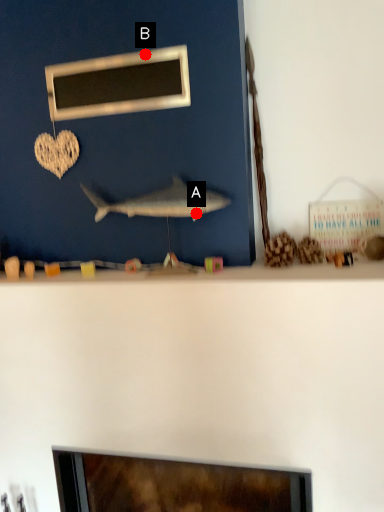
Question: Two points are circled on the image, labeled by A and B beside each circle. Which point appears closest to the camera in this image?

Choices:
 (A) A is closer
 (B) B is closer

Answer: (A)